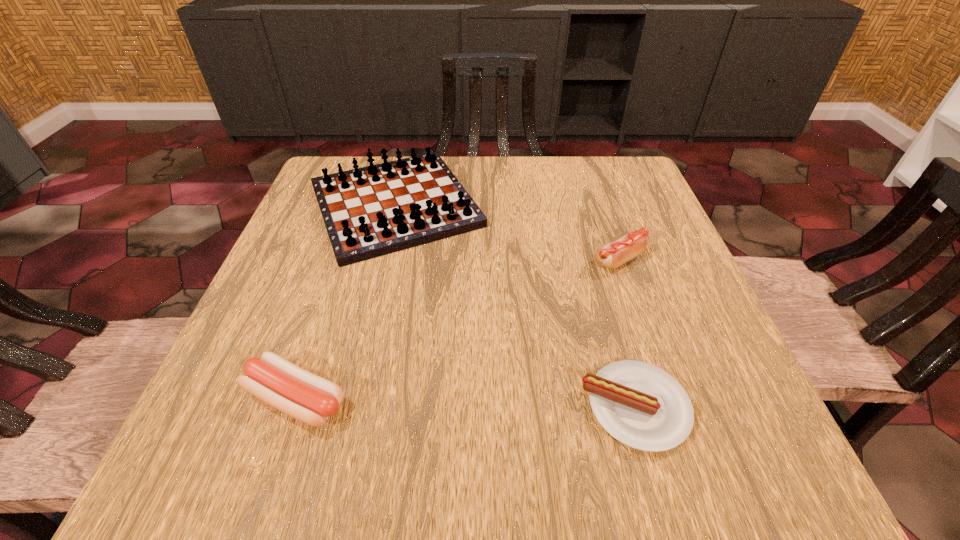
Image resolution: width=960 pixels, height=540 pixels. Find the location of `sausage situated at the left edge`. sausage situated at the left edge is located at coordinates (309, 398).

Find the location of a particular element. The width and height of the screenshot is (960, 540). object that is at the far left corner is located at coordinates (371, 211).

At what (x,y) coordinates should I click in order to perform the action: click on object located in the near left corner section of the desktop. Please return your answer as a coordinate pair (x, y). The image size is (960, 540). Looking at the image, I should click on (309, 398).

Identify the location of object situated at the near right corner. The image size is (960, 540). (642, 406).

Find the location of a particular element. The image size is (960, 540). vacant space at the far edge of the desktop is located at coordinates coord(520,195).

I want to click on vacant area at the near edge, so click(405, 460).

At what (x,y) coordinates should I click in order to perform the action: click on free space at the left edge. Please return your answer as a coordinate pair (x, y). Looking at the image, I should click on (318, 292).

The height and width of the screenshot is (540, 960). What are the coordinates of `vacant space at the right edge of the desktop` in the screenshot? It's located at (597, 231).

You are a GUI agent. You are given a task and a screenshot of the screen. Output one action in this format:
    pyautogui.click(x=<x>, y=<y>)
    Task: Click on the free location at the far right corner of the desktop
    This screenshot has width=960, height=540.
    Given the screenshot: What is the action you would take?
    pyautogui.click(x=597, y=199)

Image resolution: width=960 pixels, height=540 pixels. What are the coordinates of `vacant space that's between the leftmost sausage and the chessboard` in the screenshot? It's located at (346, 302).